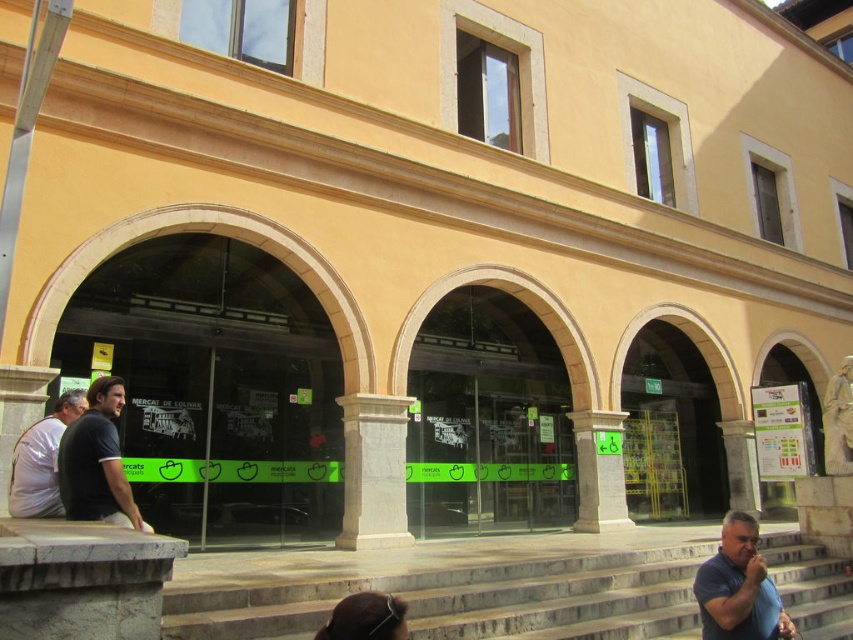
You are standing at the entrance of the building and need to reach the dark blue shirt at lower right. The gray stone column at center is in your way. Can you walk around it? Explain why or why not based on the distance between them.

The distance between the gray stone column at center and the dark blue shirt at lower right is 9.34 meters. Since the column is only blocking your direct path but there is enough space around it to navigate, you can walk around the gray stone column at center to reach the dark blue shirt at lower right.

You are standing directly in front of the building shown in the image. If you were to walk straight towards the entrance, would you walk past the gray stone column at center?

The gray stone column at center is located at coordinates (374, 472), which places it centrally in the facade. Since you are facing the building and walking straight towards the entrance, you would not walk past the column but rather approach it directly. Therefore, you would not walk past the gray stone column at center.